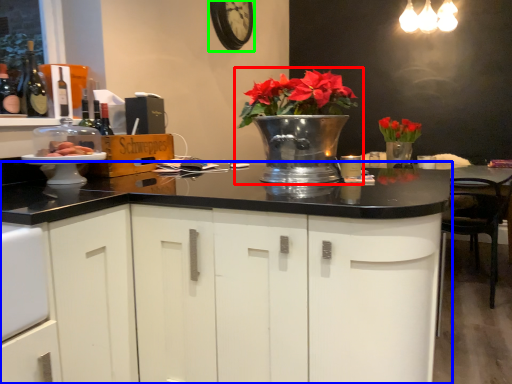
Question: Considering the real-world distances, which object is farthest from houseplant (highlighted by a red box)? cabinetry (highlighted by a blue box) or clock (highlighted by a green box)?

Choices:
 (A) cabinetry
 (B) clock

Answer: (B)